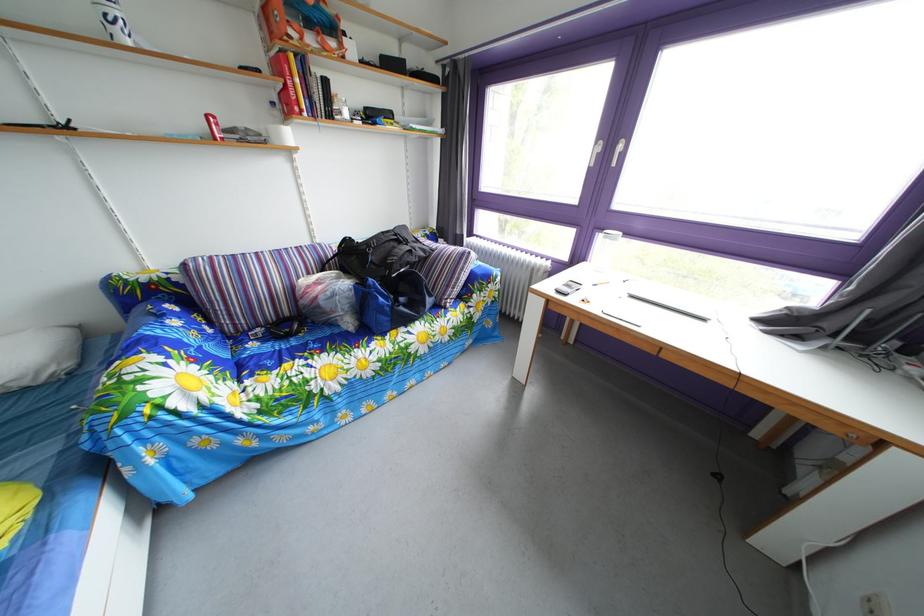
The width and height of the screenshot is (924, 616). In order to click on glass carafe in this screenshot , I will do `click(604, 249)`.